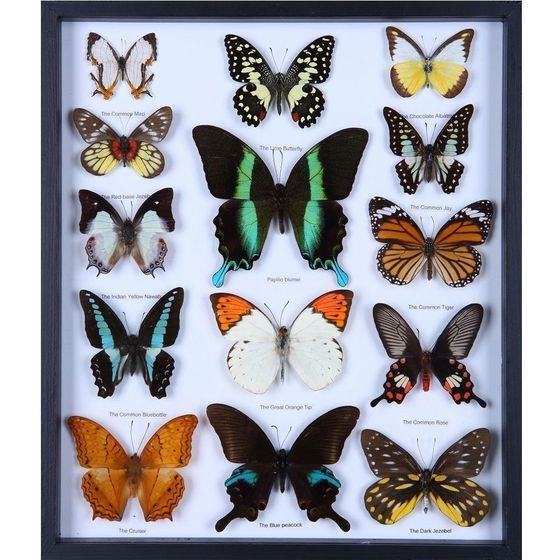
At what (x,y) coordinates should I click in order to perform the action: click on display case edges. Please return your answer as a coordinate pair (x, y). The height and width of the screenshot is (560, 560). Looking at the image, I should click on (298, 13), (48, 310), (516, 265), (269, 550).